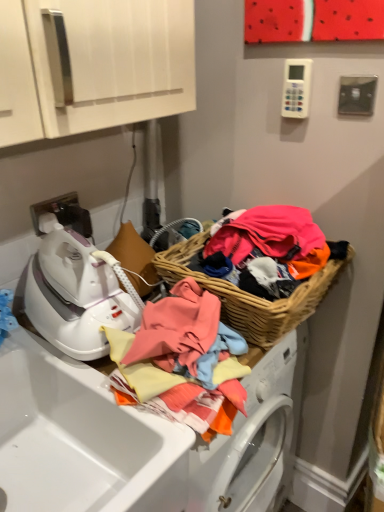
Question: In terms of height, does white glossy sink at lower left look taller or shorter compared to woven wood basket at right?

Choices:
 (A) short
 (B) tall

Answer: (B)

Question: In terms of width, does white glossy sink at lower left look wider or thinner when compared to woven wood basket at right?

Choices:
 (A) wide
 (B) thin

Answer: (A)

Question: Based on their relative distances, which object is farther from the woven wood basket at right?

Choices:
 (A) white glossy iron at left
 (B) white glossy sink at lower left

Answer: (B)

Question: Based on their relative distances, which object is nearer to the woven wood basket at right?

Choices:
 (A) white glossy iron at left
 (B) white glossy sink at lower left

Answer: (A)